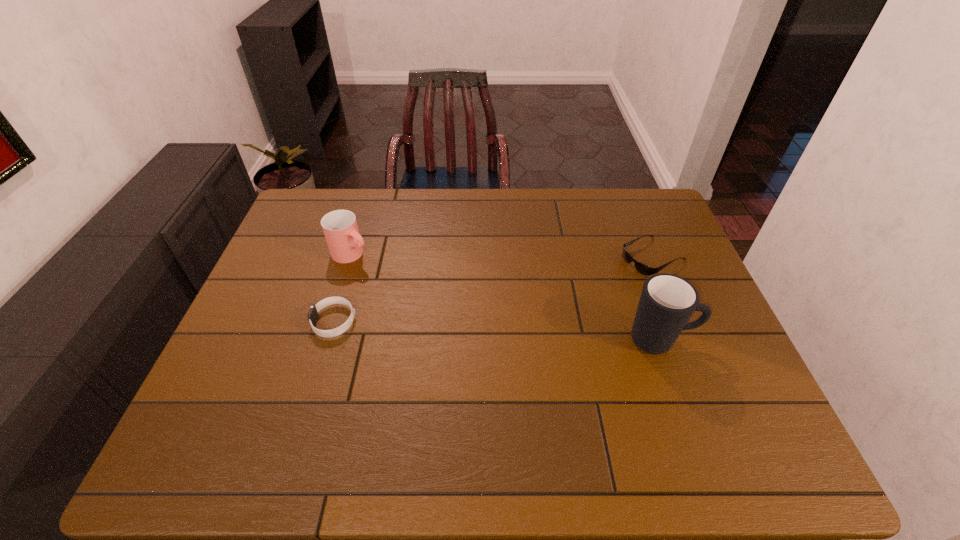
The height and width of the screenshot is (540, 960). Identify the location of object that ranks as the closest to the wristband. (340, 228).

Identify which object is located as the third nearest to the sunglasses. Please provide its 2D coordinates. Your answer should be formatted as a tuple, i.e. [(x, y)], where the tuple contains the x and y coordinates of a point satisfying the conditions above.

[(312, 316)]

Image resolution: width=960 pixels, height=540 pixels. Identify the location of vacant space that satisfies the following two spatial constraints: 1. on the front side of the cup; 2. on the side of the mug with the handle. (325, 340).

Find the location of a particular element. This screenshot has width=960, height=540. vacant space that satisfies the following two spatial constraints: 1. on the front side of the mug; 2. on the side of the cup with the handle is located at coordinates (325, 340).

Identify the location of free space that satisfies the following two spatial constraints: 1. on the front side of the second tallest object; 2. on the side of the mug with the handle. The width and height of the screenshot is (960, 540). (325, 340).